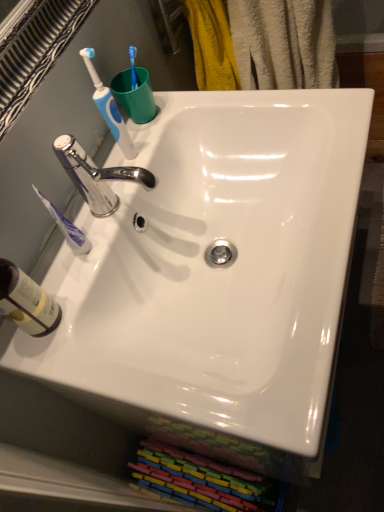
Image resolution: width=384 pixels, height=512 pixels. Describe the element at coordinates (135, 95) in the screenshot. I see `green plastic cup at upper center` at that location.

Image resolution: width=384 pixels, height=512 pixels. Describe the element at coordinates (96, 176) in the screenshot. I see `chrome metallic faucet at upper left` at that location.

What is the approximate height of white glossy sink at center?

white glossy sink at center is 5.53 inches in height.

This screenshot has width=384, height=512. What do you see at coordinates (109, 106) in the screenshot?
I see `blue plastic toothbrush at upper left, which is the first toothbrush from top to bottom` at bounding box center [109, 106].

Where is `green plastic cup at upper center`? green plastic cup at upper center is located at coordinates (135, 95).

Which object is closer to the camera, chrome metallic faucet at upper left or green plastic cup at upper center?

chrome metallic faucet at upper left is in front.

Locate an element on the screen. tap to the left of green plastic cup at upper center is located at coordinates (96, 176).

Measure the distance from chrome metallic faucet at upper left to green plastic cup at upper center.

They are 6.07 inches apart.

Is chrome metallic faucet at upper left looking in the opposite direction of green plastic cup at upper center?

No, green plastic cup at upper center is not at the back of chrome metallic faucet at upper left.

Can we say white glossy sink at center lies outside white plastic toothbrush at left, which ranks as the first toothbrush in bottom-to-top order?

Yes, white glossy sink at center is outside of white plastic toothbrush at left, which ranks as the first toothbrush in bottom-to-top order.

Is point (124, 417) in front of point (77, 246)?

No, it is not.

Identify the location of sink in front of the white plastic toothbrush at left, which is counted as the second toothbrush, starting from the top. The width and height of the screenshot is (384, 512). (215, 269).

Which object is closer to the camera taking this photo, white glossy sink at center or white plastic toothbrush at left, which ranks as the first toothbrush in bottom-to-top order?

white glossy sink at center is in front.

Which object is thinner, white plastic toothbrush at left, which is counted as the second toothbrush, starting from the top, or blue plastic toothbrush at upper left, which is the first toothbrush from top to bottom?

Thinner between the two is white plastic toothbrush at left, which is counted as the second toothbrush, starting from the top.

In the scene shown: Considering the relative positions of white plastic toothbrush at left, which ranks as the first toothbrush in bottom-to-top order, and blue plastic toothbrush at upper left, which is the first toothbrush from top to bottom, in the image provided, is white plastic toothbrush at left, which ranks as the first toothbrush in bottom-to-top order, to the right of blue plastic toothbrush at upper left, which is the first toothbrush from top to bottom, from the viewer's perspective?

No.

Does white plastic toothbrush at left, which ranks as the first toothbrush in bottom-to-top order, come in front of blue plastic toothbrush at upper left, the second toothbrush positioned from the bottom?

Yes, white plastic toothbrush at left, which ranks as the first toothbrush in bottom-to-top order, is closer to the camera.

Would you say blue plastic toothbrush at upper left, which is the first toothbrush from top to bottom, is part of white plastic toothbrush at left, which is counted as the second toothbrush, starting from the top,'s contents?

No, blue plastic toothbrush at upper left, which is the first toothbrush from top to bottom, is not surrounded by white plastic toothbrush at left, which is counted as the second toothbrush, starting from the top.

Is green plastic cup at upper center spatially inside blue plastic toothbrush at upper left, which is the first toothbrush from top to bottom, or outside of it?

green plastic cup at upper center is outside blue plastic toothbrush at upper left, which is the first toothbrush from top to bottom.

Considering the positions of objects green plastic cup at upper center and blue plastic toothbrush at upper left, the second toothbrush positioned from the bottom, in the image provided, who is more to the left, green plastic cup at upper center or blue plastic toothbrush at upper left, the second toothbrush positioned from the bottom,?

Positioned to the left is blue plastic toothbrush at upper left, the second toothbrush positioned from the bottom.

Is point (138, 72) positioned before point (92, 79)?

No, it is behind (92, 79).

Can you confirm if chrome metallic faucet at upper left is bigger than white glossy sink at center?

Incorrect, chrome metallic faucet at upper left is not larger than white glossy sink at center.

Is chrome metallic faucet at upper left shorter than white glossy sink at center?

No, chrome metallic faucet at upper left is not shorter than white glossy sink at center.

Would you say chrome metallic faucet at upper left contains white glossy sink at center?

No.

Considering the relative positions of chrome metallic faucet at upper left and white glossy sink at center in the image provided, is chrome metallic faucet at upper left to the left or to the right of white glossy sink at center?

chrome metallic faucet at upper left is to the left of white glossy sink at center.

Considering the sizes of white glossy sink at center and green plastic cup at upper center in the image, is white glossy sink at center bigger or smaller than green plastic cup at upper center?

Clearly, white glossy sink at center is larger in size than green plastic cup at upper center.

Considering the sizes of objects white glossy sink at center and green plastic cup at upper center in the image provided, who is taller, white glossy sink at center or green plastic cup at upper center?

white glossy sink at center.

Locate an element on the screen. Image resolution: width=384 pixels, height=512 pixels. sink located underneath the green plastic cup at upper center (from a real-world perspective) is located at coordinates (215, 269).

Which point is more distant from viewer, (151,305) or (122,96)?

Point (122,96)

Who is smaller, white plastic toothbrush at left, which ranks as the first toothbrush in bottom-to-top order, or translucent plastic bottle at lower left?

With smaller size is white plastic toothbrush at left, which ranks as the first toothbrush in bottom-to-top order.

Does white plastic toothbrush at left, which ranks as the first toothbrush in bottom-to-top order, touch translucent plastic bottle at lower left?

There is a gap between white plastic toothbrush at left, which ranks as the first toothbrush in bottom-to-top order, and translucent plastic bottle at lower left.

Is white plastic toothbrush at left, which ranks as the first toothbrush in bottom-to-top order, facing towards translucent plastic bottle at lower left?

No, white plastic toothbrush at left, which ranks as the first toothbrush in bottom-to-top order, is not aimed at translucent plastic bottle at lower left.

From a real-world perspective, is white plastic toothbrush at left, which is counted as the second toothbrush, starting from the top, physically above translucent plastic bottle at lower left?

No, from a real-world perspective, white plastic toothbrush at left, which is counted as the second toothbrush, starting from the top, is not above translucent plastic bottle at lower left.

Identify the location of coffee cup lying behind the chrome metallic faucet at upper left. This screenshot has height=512, width=384. (135, 95).

From the image's perspective, which toothbrush is the 1st one above the white glossy sink at center? Please provide its 2D coordinates.

[(67, 228)]

Estimate the real-world distances between objects in this image. Which object is closer to blue plastic toothbrush at upper left, which is the first toothbrush from top to bottom, translucent plastic bottle at lower left or chrome metallic faucet at upper left?

chrome metallic faucet at upper left lies closer to blue plastic toothbrush at upper left, which is the first toothbrush from top to bottom, than the other object.

When comparing their distances from white glossy sink at center, does translucent plastic bottle at lower left or chrome metallic faucet at upper left seem closer?

Based on the image, chrome metallic faucet at upper left appears to be nearer to white glossy sink at center.

Based on their spatial positions, is chrome metallic faucet at upper left or white glossy sink at center closer to white plastic toothbrush at left, which ranks as the first toothbrush in bottom-to-top order?

chrome metallic faucet at upper left.

Consider the image. Based on their spatial positions, is white plastic toothbrush at left, which is counted as the second toothbrush, starting from the top, or chrome metallic faucet at upper left closer to green plastic cup at upper center?

Based on the image, chrome metallic faucet at upper left appears to be nearer to green plastic cup at upper center.

Which object lies nearer to the anchor point white glossy sink at center, chrome metallic faucet at upper left or blue plastic toothbrush at upper left, which is the first toothbrush from top to bottom?

The object closer to white glossy sink at center is chrome metallic faucet at upper left.

Based on the photo, estimate the real-world distances between objects in this image. Which object is further from translucent plastic bottle at lower left, chrome metallic faucet at upper left or blue plastic toothbrush at upper left, the second toothbrush positioned from the bottom?

blue plastic toothbrush at upper left, the second toothbrush positioned from the bottom, lies further to translucent plastic bottle at lower left than the other object.

Estimate the real-world distances between objects in this image. Which object is further from green plastic cup at upper center, blue plastic toothbrush at upper left, the second toothbrush positioned from the bottom, or white glossy sink at center?

white glossy sink at center is further to green plastic cup at upper center.

Based on their spatial positions, is translucent plastic bottle at lower left or blue plastic toothbrush at upper left, which is the first toothbrush from top to bottom, further from chrome metallic faucet at upper left?

translucent plastic bottle at lower left.

Locate an element on the screen. This screenshot has width=384, height=512. sink between blue plastic toothbrush at upper left, which is the first toothbrush from top to bottom, and translucent plastic bottle at lower left vertically is located at coordinates (215, 269).

This screenshot has width=384, height=512. What are the coordinates of `tap between blue plastic toothbrush at upper left, the second toothbrush positioned from the bottom, and white plastic toothbrush at left, which ranks as the first toothbrush in bottom-to-top order, from top to bottom` in the screenshot? It's located at (96, 176).

Locate an element on the screen. Image resolution: width=384 pixels, height=512 pixels. toothbrush between blue plastic toothbrush at upper left, the second toothbrush positioned from the bottom, and white glossy sink at center vertically is located at coordinates (67, 228).

Find the location of a particular element. The image size is (384, 512). tap situated between translucent plastic bottle at lower left and white glossy sink at center from left to right is located at coordinates (96, 176).